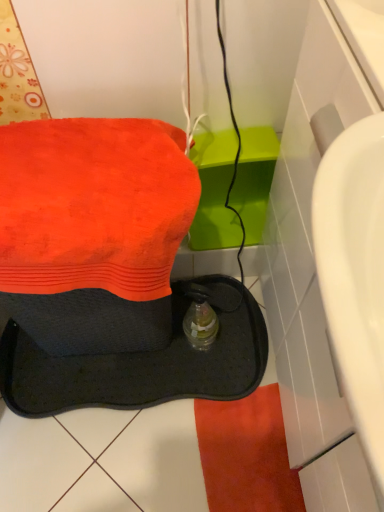
This screenshot has width=384, height=512. Find the location of `vacant area that is in front of translucent plastic bottle at center`. vacant area that is in front of translucent plastic bottle at center is located at coordinates (200, 381).